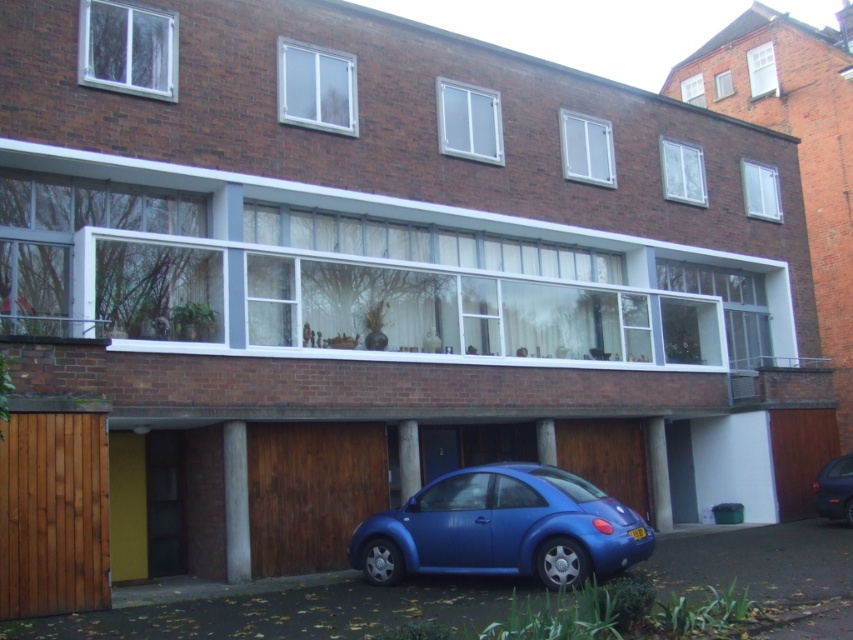
Question: Can you confirm if brown wooden garage door at lower center is positioned below blue matte car at lower right?

Choices:
 (A) no
 (B) yes

Answer: (A)

Question: Estimate the real-world distances between objects in this image. Which object is farther from the blue metallic car at lower center?

Choices:
 (A) blue matte car at lower right
 (B) brown wooden garage door at lower center

Answer: (A)

Question: Among these points, which one is farthest from the camera?

Choices:
 (A) (846, 508)
 (B) (286, 435)
 (C) (525, 500)

Answer: (A)

Question: Based on their relative distances, which object is farther from the blue metallic car at lower center?

Choices:
 (A) brown wooden garage door at lower center
 (B) blue matte car at lower right

Answer: (B)

Question: Does brown wooden garage door at lower center lie behind blue matte car at lower right?

Choices:
 (A) yes
 (B) no

Answer: (B)

Question: Is blue metallic car at lower center wider than brown wooden garage door at lower center?

Choices:
 (A) yes
 (B) no

Answer: (A)